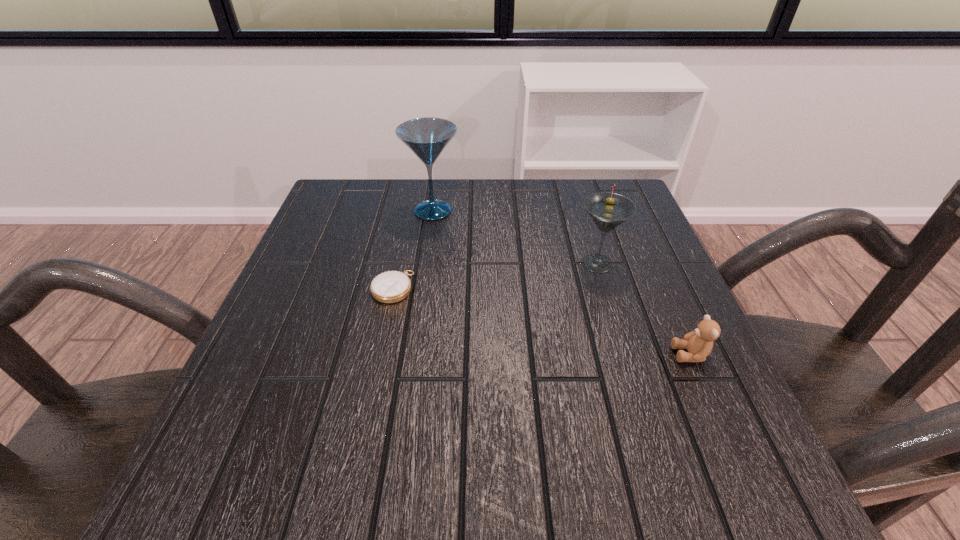
Where is `blank region between the teddy bear and the compass`? blank region between the teddy bear and the compass is located at coordinates (541, 321).

This screenshot has width=960, height=540. In order to click on vacant region between the farther martini and the shortest object in this screenshot , I will do `click(413, 249)`.

This screenshot has height=540, width=960. What are the coordinates of `object that is the third nearest to the taller martini` in the screenshot? It's located at (699, 343).

Locate an element on the screen. object that stands as the third closest to the farther martini is located at coordinates (699, 343).

What are the coordinates of `free space that satisfies the following two spatial constraints: 1. on the back side of the second object from right to left; 2. on the right side of the shortest object` in the screenshot? It's located at pyautogui.click(x=397, y=263).